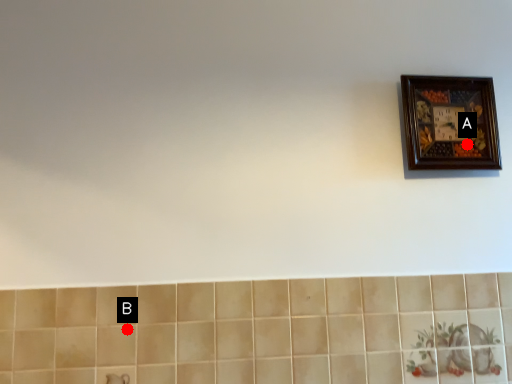
Question: Two points are circled on the image, labeled by A and B beside each circle. Which point is closer to the camera taking this photo?

Choices:
 (A) A is closer
 (B) B is closer

Answer: (B)